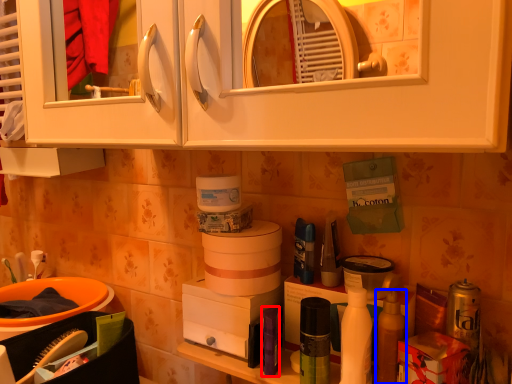
Question: Which object is further to the camera taking this photo, toiletry (highlighted by a red box) or mouthwash (highlighted by a blue box)?

Choices:
 (A) toiletry
 (B) mouthwash

Answer: (A)